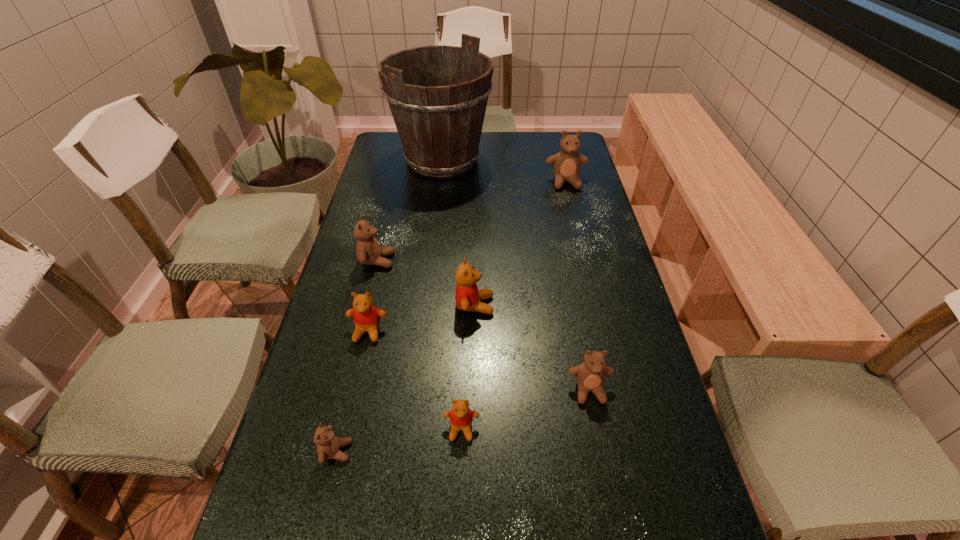
Identify the location of bucket located at the left edge. (439, 123).

Image resolution: width=960 pixels, height=540 pixels. In order to click on object that is positioned at the far left corner in this screenshot , I will do `click(439, 123)`.

In the image, there is a desktop. At what (x,y) coordinates should I click in order to perform the action: click on vacant space at the left edge. Please return your answer as a coordinate pair (x, y). The image size is (960, 540). Looking at the image, I should click on (305, 379).

You are a GUI agent. You are given a task and a screenshot of the screen. Output one action in this format:
    pyautogui.click(x=<x>, y=<y>)
    Task: Click on the vacant space at the right edge of the desktop
    The image size is (960, 540).
    Given the screenshot: What is the action you would take?
    pyautogui.click(x=633, y=536)

In the image, there is a desktop. Identify the location of vacant space at the far left corner. (397, 144).

Locate an element on the screen. vacant space at the far right corner of the desktop is located at coordinates (548, 134).

Locate an element on the screen. Image resolution: width=960 pixels, height=540 pixels. vacant point located between the bucket and the farthest teddy bear is located at coordinates (504, 171).

What are the coordinates of `unoccupied position between the third farthest object and the second smallest red teddy bear` in the screenshot? It's located at (372, 296).

Where is `vacant point located between the tallest object and the seventh shortest object`? vacant point located between the tallest object and the seventh shortest object is located at coordinates (504, 171).

Locate an element on the screen. The image size is (960, 540). vacant space that's between the biggest red teddy bear and the nearest brown teddy bear is located at coordinates (406, 378).